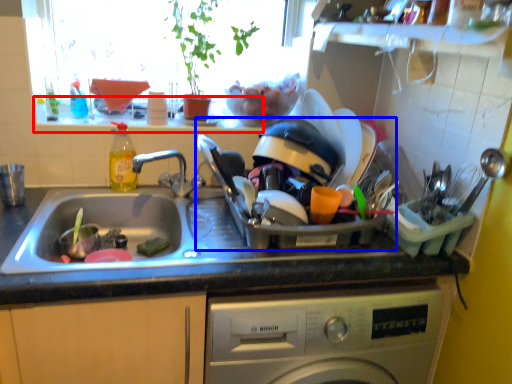
Question: Which object is further to the camera taking this photo, window sill (highlighted by a red box) or appliance (highlighted by a blue box)?

Choices:
 (A) window sill
 (B) appliance

Answer: (A)